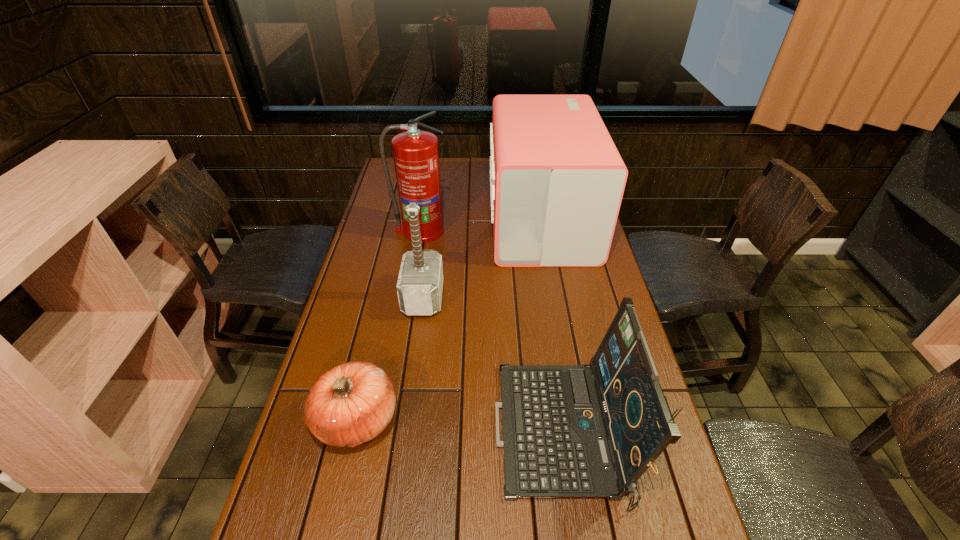
Identify the location of free space located 0.390m on the front-facing side of the laptop computer. (327, 433).

This screenshot has width=960, height=540. I want to click on vacant region located on the front-facing side of the laptop computer, so click(x=348, y=433).

Locate an element on the screen. vacant region located 0.240m on the front-facing side of the laptop computer is located at coordinates (392, 433).

This screenshot has height=540, width=960. I want to click on vacant area located 0.230m on the right of the shortest object, so click(496, 418).

Where is `object present at the far edge`? The width and height of the screenshot is (960, 540). object present at the far edge is located at coordinates pyautogui.click(x=557, y=180).

Find the location of a particular element. fire extinguisher that is at the left edge is located at coordinates (416, 158).

Where is `pumpkin present at the left edge`? pumpkin present at the left edge is located at coordinates (352, 403).

Identify the location of box situated at the right edge. Image resolution: width=960 pixels, height=540 pixels. (557, 180).

Locate an element on the screen. This screenshot has width=960, height=540. laptop computer present at the right edge is located at coordinates (591, 431).

You are a GUI agent. You are given a task and a screenshot of the screen. Output one action in this format:
    pyautogui.click(x=<x>, y=<y>)
    Task: Click on the object positioned at the far right corner
    The width and height of the screenshot is (960, 540).
    Given the screenshot: What is the action you would take?
    pyautogui.click(x=557, y=180)